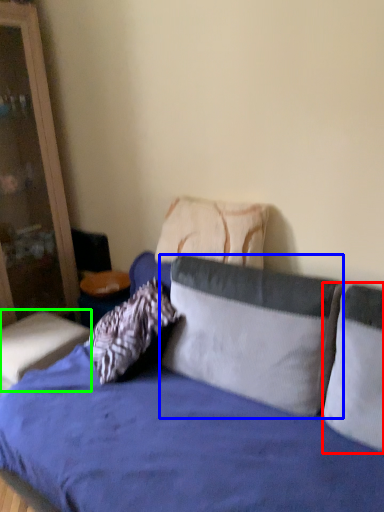
Question: Which is nearer to the pillow (highlighted by a red box)? pillow (highlighted by a blue box) or table (highlighted by a green box).

Choices:
 (A) pillow
 (B) table

Answer: (A)